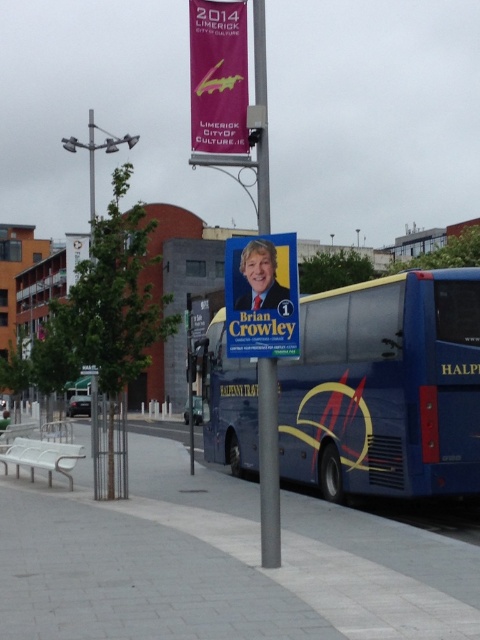
Does blue metallic bus at center have a lesser width compared to matte blue poster at center?

Incorrect, blue metallic bus at center's width is not less than matte blue poster at center's.

Which is behind, point (395, 401) or point (264, 253)?

The point (395, 401) is behind.

You are a GUI agent. You are given a task and a screenshot of the screen. Output one action in this format:
    pyautogui.click(x=<x>, y=<y>)
    Task: Click on the blue metallic bus at center
    
    Given the screenshot: What is the action you would take?
    pyautogui.click(x=385, y=387)

Describe the element at coordinates (218, 563) in the screenshot. I see `gray concrete pavement at center` at that location.

How distant is gray concrete pavement at center from blue metallic bus at center?

1.79 meters

Measure the distance between gray concrete pavement at center and camera.

gray concrete pavement at center is 19.26 feet from camera.

I want to click on gray concrete pavement at center, so click(218, 563).

Who is higher up, matte purple banner at upper center or matte blue poster at center?

matte purple banner at upper center

Which is more to the left, matte purple banner at upper center or matte blue poster at center?

From the viewer's perspective, matte purple banner at upper center appears more on the left side.

Does point (245, 19) lie in front of point (248, 240)?

No.

Locate an element on the screen. The height and width of the screenshot is (640, 480). matte purple banner at upper center is located at coordinates (217, 76).